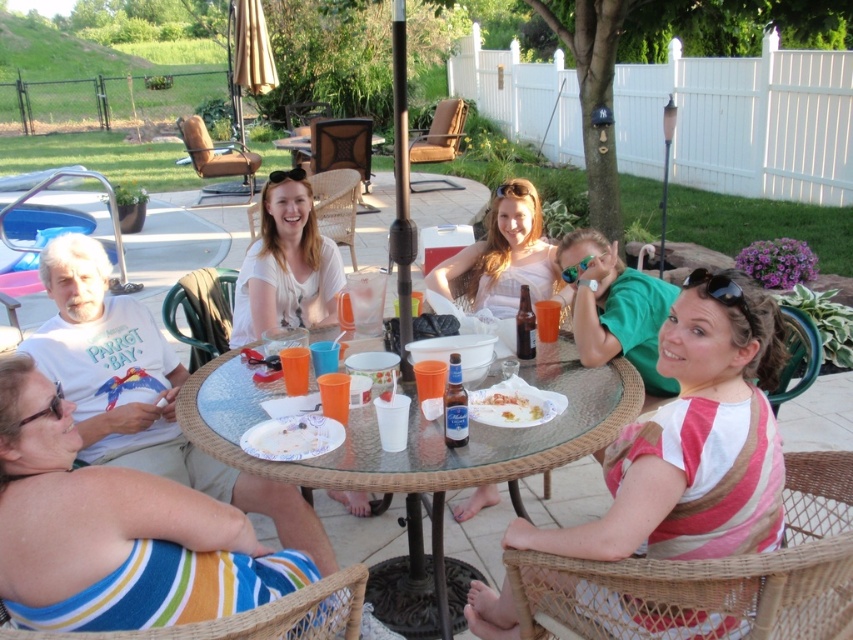
Is striped fabric shirt at lower left to the left of white paper plate at center from the viewer's perspective?

Yes, striped fabric shirt at lower left is to the left of white paper plate at center.

Between striped fabric shirt at lower left and white paper plate at center, which one appears on the right side from the viewer's perspective?

white paper plate at center

The height and width of the screenshot is (640, 853). What are the coordinates of `striped fabric shirt at lower left` in the screenshot? It's located at (664, 352).

Who is shorter, striped fabric bikini top at lower left or white paper plate at center?

white paper plate at center

Which is more to the left, striped fabric bikini top at lower left or white paper plate at center?

striped fabric bikini top at lower left

Measure the distance between striped fabric bikini top at lower left and camera.

striped fabric bikini top at lower left and camera are 5.08 feet apart.

Find the location of `striped fabric bikini top at lower left`. striped fabric bikini top at lower left is located at coordinates (114, 531).

Between pink striped shirt at lower right and matte white dress at center, which one appears on the left side from the viewer's perspective?

matte white dress at center is more to the left.

Can you confirm if pink striped shirt at lower right is positioned above matte white dress at center?

Actually, pink striped shirt at lower right is below matte white dress at center.

Who is more forward, (666,362) or (486,492)?

Point (666,362) is more forward.

Where is `pink striped shirt at lower right`? pink striped shirt at lower right is located at coordinates pyautogui.click(x=693, y=440).